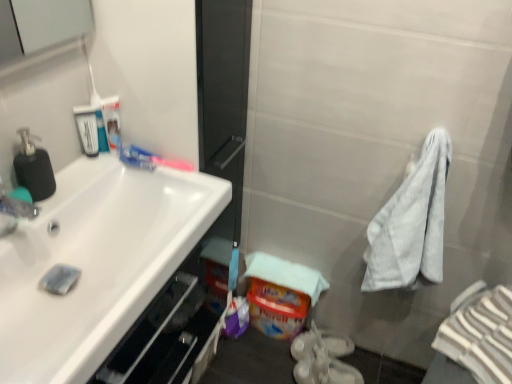
The image size is (512, 384). What are the coordinates of `free space in front of white plastic mouthwash at upper left, acting as the 1th mouthwash starting from the left` in the screenshot? It's located at (77, 182).